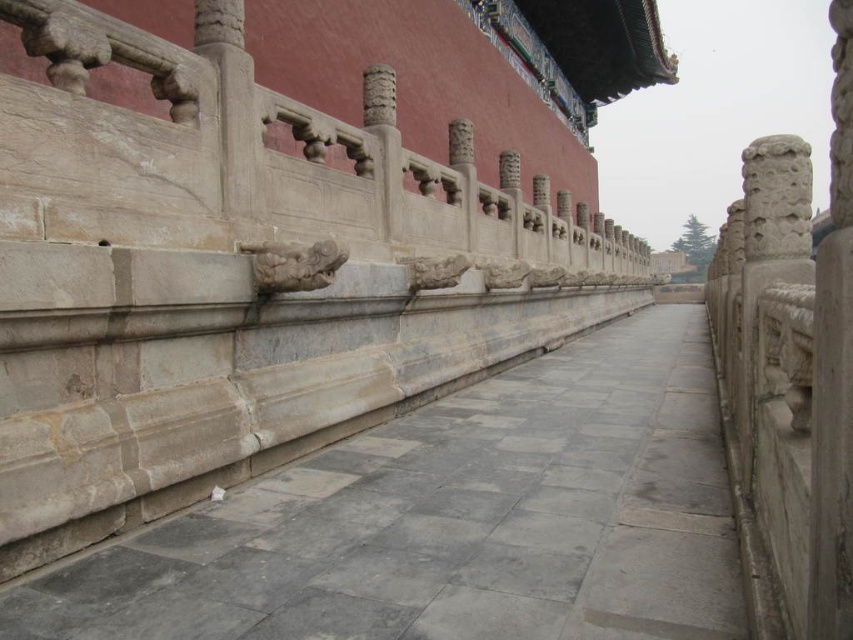
You are standing at the entrance of the historical site and want to walk towards the gray stone path at center. According to the coordinates provided, in which direction should you move relative to your current position?

You should move towards the point at coordinates (453, 518) to reach the gray stone path at center.

You are a visitor walking on the gray stone path at center in a traditional Chinese garden. You want to place a small souvenir on the gray stone railing at center. Can you do this without needing to climb up? Explain why based on their heights.

The gray stone path at center has a lesser height compared to the gray stone railing at center. Since the railing is taller than the path, you would need to climb up slightly to place the souvenir on the railing.

You are standing at the entrance of the palace complex and see two points marked on the pathway. The first point is labeled as point (611, 362) and the second is point (90, 193). Which point is closer to the entrance?

Point (90, 193) is closer to the entrance because point (611, 362) is behind it.